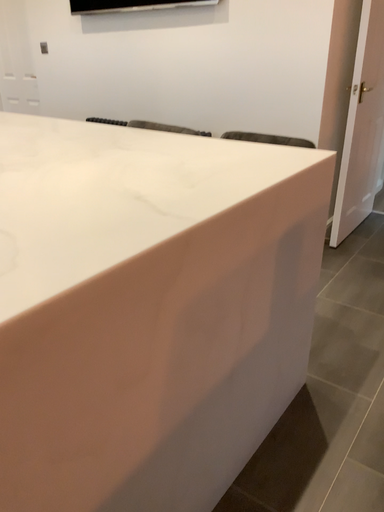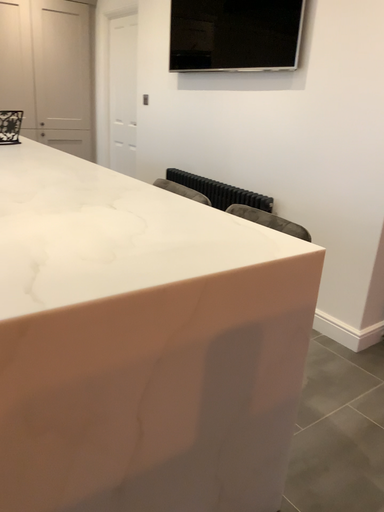
Question: Which way did the camera rotate in the video?

Choices:
 (A) rotated right
 (B) rotated left

Answer: (B)